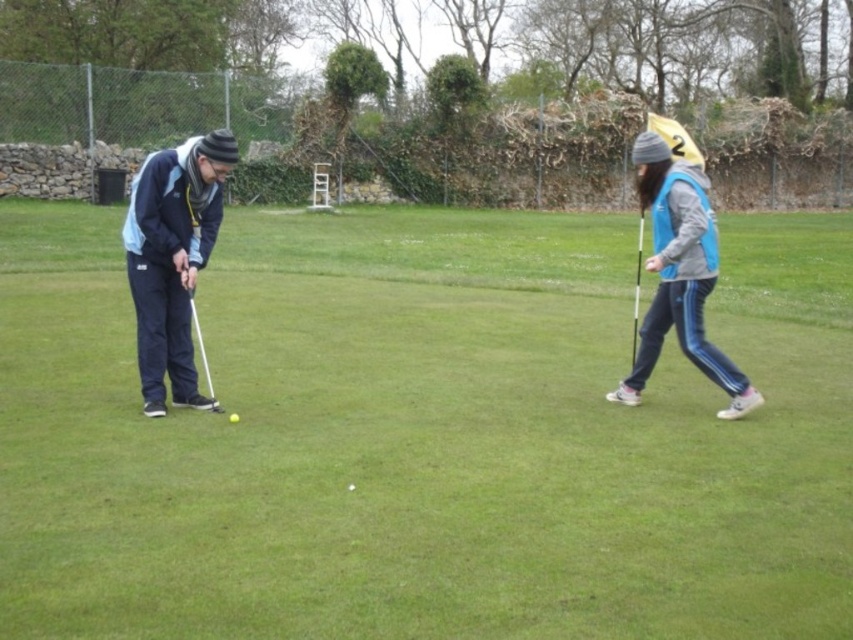
You are a golfer who wants to know which item is narrower between the blue fabric vest at right and the metallic silver golf club at right. Which one is it?

The blue fabric vest at right has a lesser width compared to the metallic silver golf club at right, so the blue fabric vest at right is narrower.

You are a golfer standing at the edge of the green grass at center with a metallic silver golf club at right. You want to hit a golf ball from the grass to a hole 5 meters away. Can you reach the hole with one swing?

The distance between the green grass at center and metallic silver golf club at right is 3.81 meters. Since the hole is 5 meters away, you cannot reach it in one swing with the current setup.